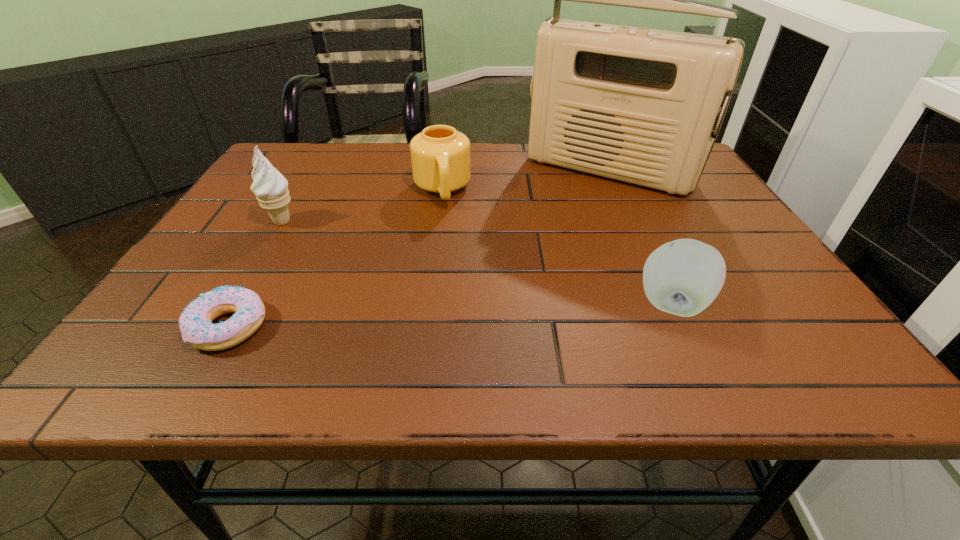
In order to click on vacant space located 0.310m on the front-facing side of the third nearest object in this screenshot , I will do point(386,285).

I want to click on vacant space located 0.250m on the handle side of the third object from left to right, so click(454, 281).

This screenshot has height=540, width=960. I want to click on vacant space located 0.360m on the handle side of the third object from left to right, so click(x=461, y=322).

Locate an element on the screen. Image resolution: width=960 pixels, height=540 pixels. blank area located on the handle side of the third object from left to right is located at coordinates (446, 231).

Find the location of `free space located 0.400m on the front-facing side of the tallest object`. free space located 0.400m on the front-facing side of the tallest object is located at coordinates (510, 294).

Image resolution: width=960 pixels, height=540 pixels. Identify the location of vacant area located on the front-facing side of the tallest object. (556, 230).

This screenshot has height=540, width=960. I want to click on vacant region located on the front-facing side of the tallest object, so click(x=543, y=246).

I want to click on mug located at the far edge, so click(440, 156).

Locate an element on the screen. This screenshot has width=960, height=540. radio receiver that is at the far edge is located at coordinates (638, 105).

Where is `doughnut that is positioned at the near edge`? doughnut that is positioned at the near edge is located at coordinates click(195, 323).